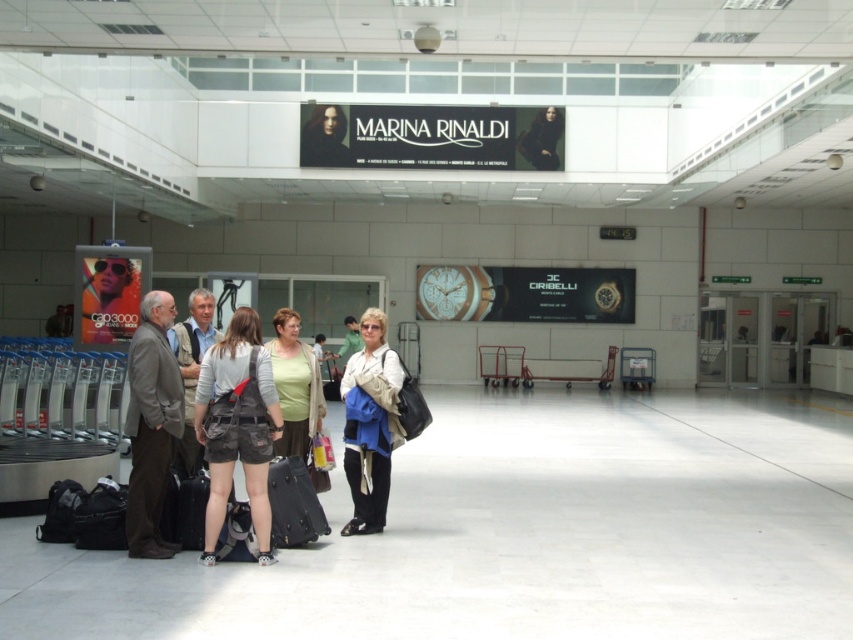
Consider the image. Is light gray fabric jacket at center behind black textured suitcase at center?

That is True.

Is light gray fabric jacket at center smaller than black textured suitcase at center?

Actually, light gray fabric jacket at center might be larger than black textured suitcase at center.

Where is `light gray fabric jacket at center`? This screenshot has height=640, width=853. light gray fabric jacket at center is located at coordinates (190, 371).

Image resolution: width=853 pixels, height=640 pixels. What are the coordinates of `light gray fabric jacket at center` in the screenshot? It's located at (190, 371).

Is light green jersey at center thinner than black textured suitcase at center?

No.

Is point (286, 420) positioned in front of point (306, 518)?

No.

Between point (288, 436) and point (299, 516), which one is positioned behind?

Point (288, 436)

Where is `light green jersey at center`? Image resolution: width=853 pixels, height=640 pixels. light green jersey at center is located at coordinates (294, 385).

Who is more distant from viewer, (548,148) or (338,356)?

The point (548,148) is more distant.

From the picture: Can you confirm if black leather jacket at upper center is taller than light brown leather jacket at center?

Indeed, black leather jacket at upper center has a greater height compared to light brown leather jacket at center.

Locate an element on the screen. The width and height of the screenshot is (853, 640). black leather jacket at upper center is located at coordinates (543, 140).